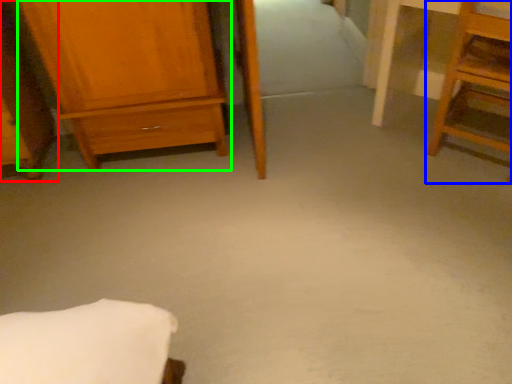
Question: Based on their relative distances, which object is nearer to furniture (highlighted by a red box)? Choose from furniture (highlighted by a blue box) and chest of drawers (highlighted by a green box).

Choices:
 (A) furniture
 (B) chest of drawers

Answer: (B)